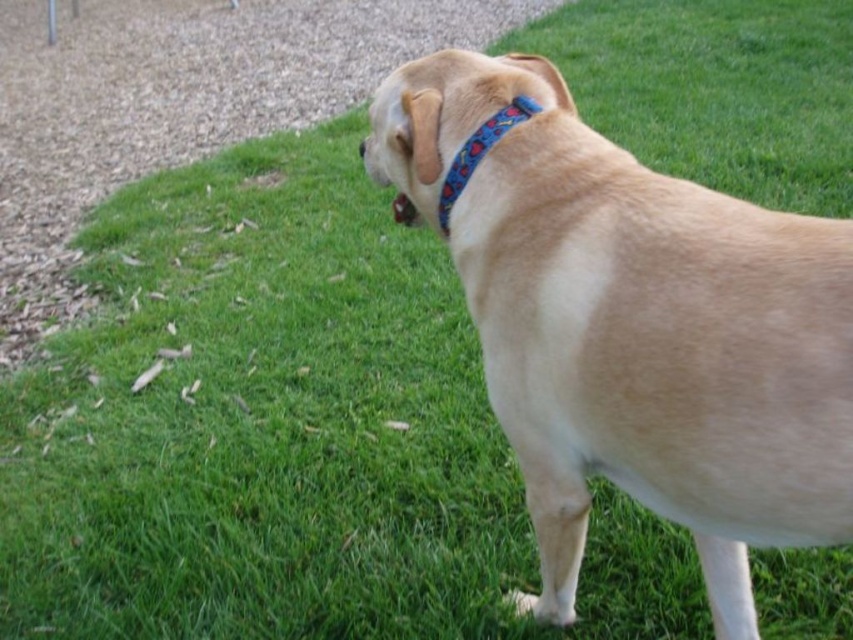
Question: Can you confirm if light brown fur at center is thinner than blue fabric neckband at upper center?

Choices:
 (A) no
 (B) yes

Answer: (A)

Question: Observing the image, what is the correct spatial positioning of light brown fur at center in reference to blue fabric neckband at upper center?

Choices:
 (A) below
 (B) above

Answer: (A)

Question: Does light brown fur at center have a greater width compared to blue fabric neckband at upper center?

Choices:
 (A) yes
 (B) no

Answer: (A)

Question: Among these objects, which one is nearest to the camera?

Choices:
 (A) blue fabric neckband at upper center
 (B) light brown fur at center

Answer: (B)